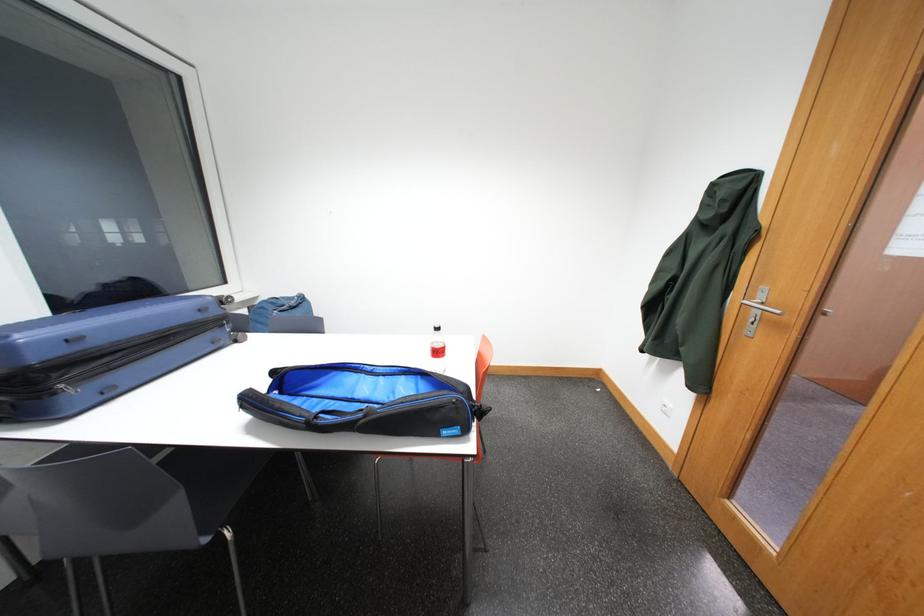
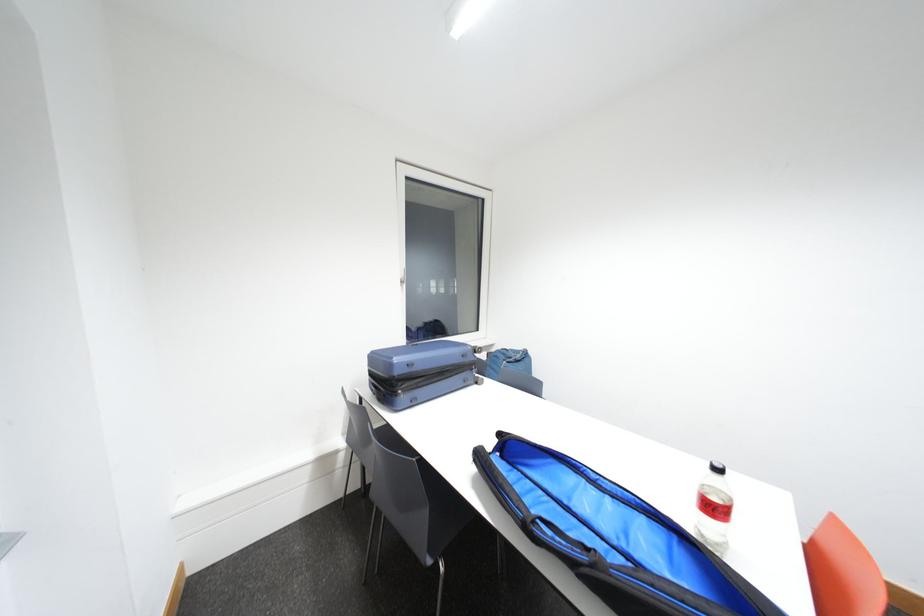
Question: Based on the continuous images, in which direction is the camera rotating? Reply with the corresponding letter.

Choices:
 (A) Left
 (B) Right
 (C) Up
 (D) Down

Answer: (A)